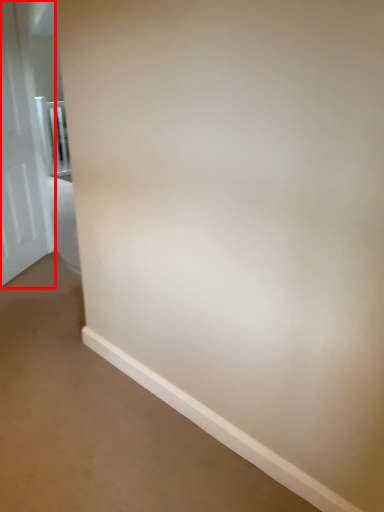
Question: From the image's perspective, what is the correct spatial positioning of door (annotated by the red box) in reference to balustrade?

Choices:
 (A) below
 (B) above

Answer: (A)